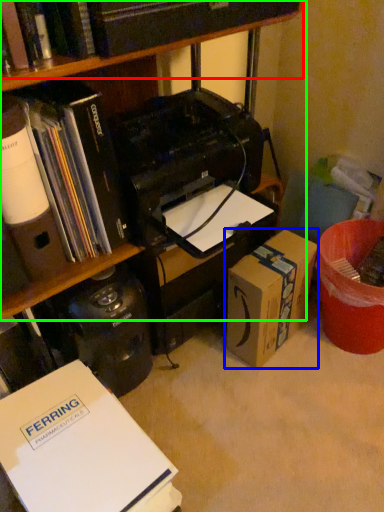
Question: Estimate the real-world distances between objects in this image. Which object is closer to book (highlighted by a red box), box (highlighted by a blue box) or bookcase (highlighted by a green box)?

Choices:
 (A) box
 (B) bookcase

Answer: (B)